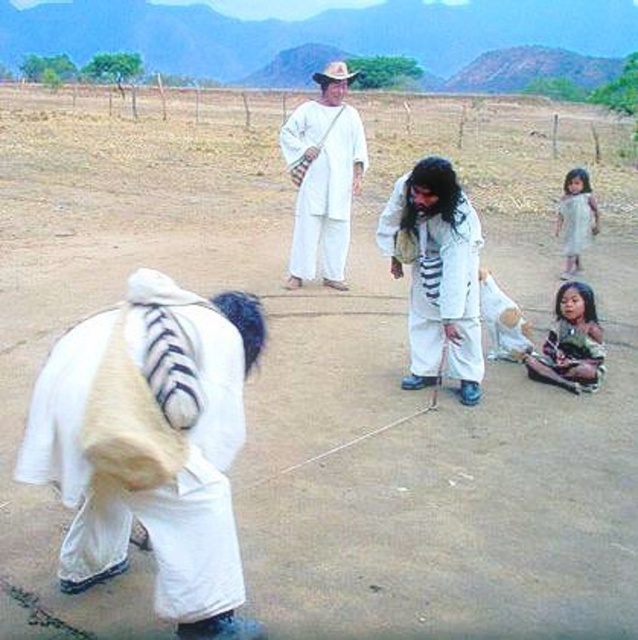
In the scene shown: You are a photographer trying to capture a closeup of the two points in the image. Which point, point (84,515) or point (590,330), is closer to your camera lens?

Point (84,515) is closer to the camera lens than point (590,330).

You are a photographer planning to take a photo of the scene described. You want to ensure that both the white cotton robe at center and the white cotton dress at lower right are clearly visible. Given their height difference, where should you position yourself to capture both effectively?

The white cotton robe at center is much taller than the white cotton dress at lower right. To capture both effectively, position yourself at a lower angle so that the robe at center doesn not block the dress at lower right, ensuring both are visible in the frame.

You are an observer in the scene described. You notice two white garments in the image. Which garment is positioned lower in the image, the white cotton robe at center or the white cotton dress at lower right?

The white cotton robe at center is positioned below the white cotton dress at lower right, so the white cotton robe at center is lower in the image.